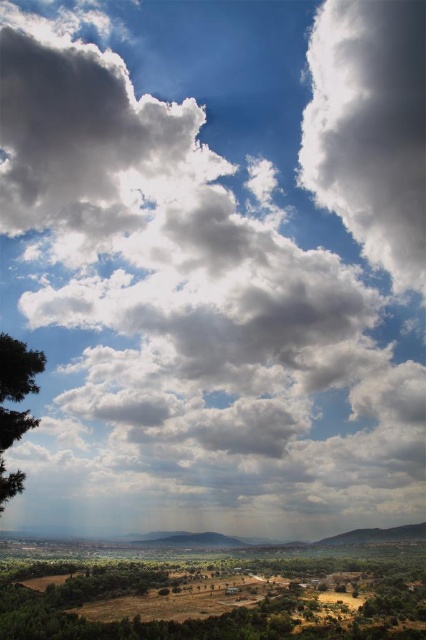
Based on the photo, does green matte tree at left have a lesser width compared to green leafy tree at lower center?

Yes.

Consider the image. Is green matte tree at left to the left of green leafy tree at lower center from the viewer's perspective?

Incorrect, green matte tree at left is not on the left side of green leafy tree at lower center.

Which is behind, point (29, 369) or point (77, 573)?

Point (77, 573)

This screenshot has height=640, width=426. In order to click on green matte tree at left in this screenshot , I will do `click(14, 401)`.

Is brown textured tree at lower left smaller than green matte tree at left?

No, brown textured tree at lower left is not smaller than green matte tree at left.

Is brown textured tree at lower left bigger than green matte tree at left?

Correct, brown textured tree at lower left is larger in size than green matte tree at left.

Which is in front, point (331, 573) or point (13, 481)?

Point (13, 481) is more forward.

This screenshot has height=640, width=426. What are the coordinates of `brown textured tree at lower left` in the screenshot? It's located at (213, 598).

Looking at this image, is brown textured tree at lower left to the left of green leafy tree at lower center from the viewer's perspective?

In fact, brown textured tree at lower left is to the right of green leafy tree at lower center.

Is point (43, 616) closer to viewer compared to point (48, 602)?

Yes, it is in front of point (48, 602).

The height and width of the screenshot is (640, 426). What are the coordinates of `brown textured tree at lower left` in the screenshot? It's located at (213, 598).